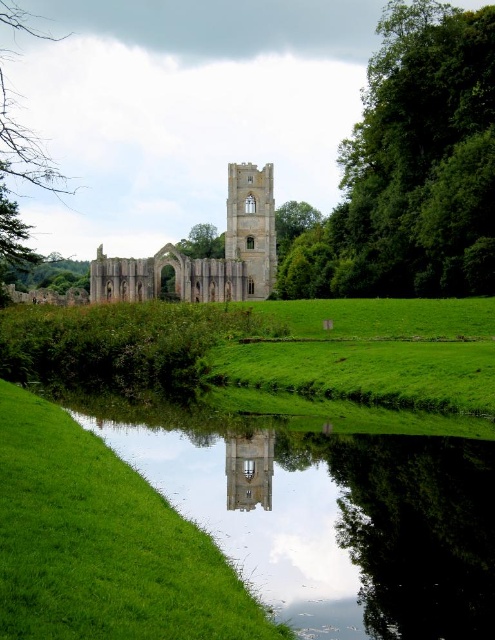
You are standing at the edge of the green grassy at lower left and want to take a photo of the green leafy tree at upper left. Can you see the entire tree in your camera frame without moving your position?

The green grassy at lower left is not as tall as the green leafy tree at upper left, so you can see the entire tree in your camera frame without moving your position because the grass is shorter and won

You are standing at the edge of the water in the scene of Fountains Abbey ruins. You notice two points marked in the image. The first point is at coordinates point (394,168) and the second is at point (260,486). If you want to reach both points by walking straight ahead, which point will you encounter first?

You will encounter point (394,168) first because it is closer to you than point (260,486), which is further away according to their positions in the image.